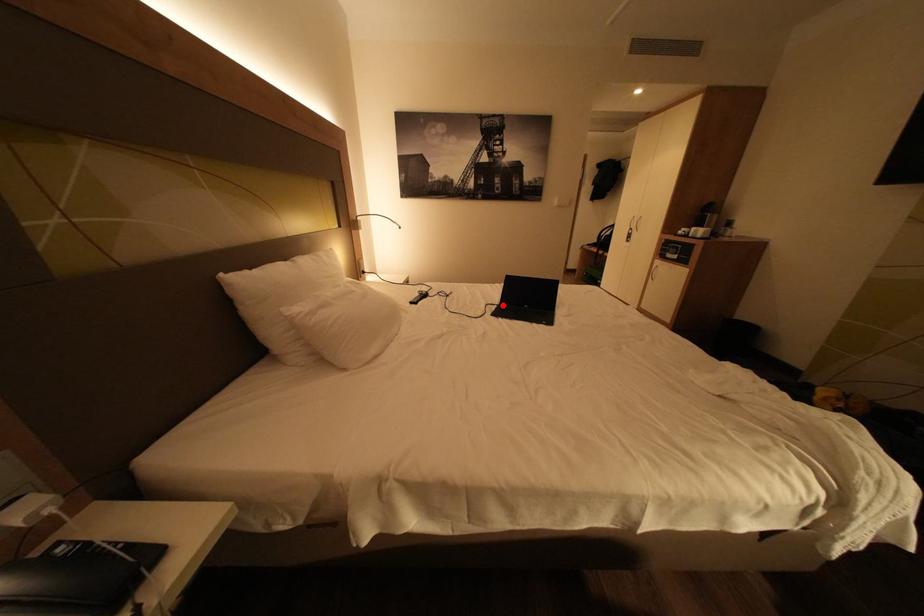
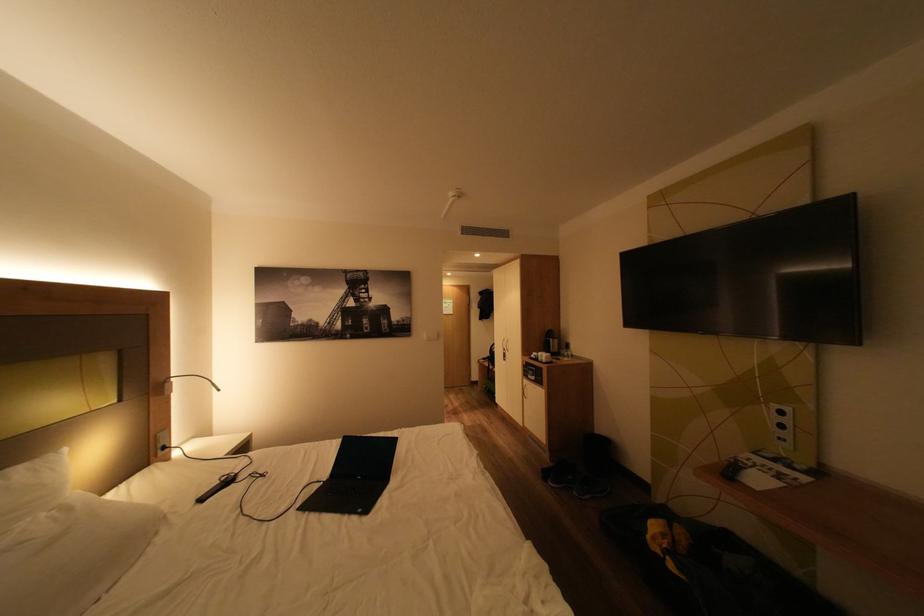
Find the pixel in the second image that matches the highlighted location in the first image.

(329, 483)